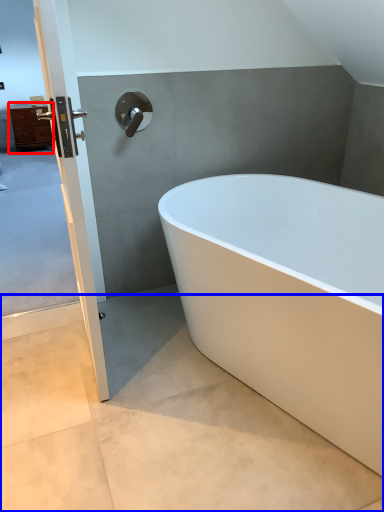
Question: Which point is further to the camera, chest of drawers (highlighted by a red box) or concrete (highlighted by a blue box)?

Choices:
 (A) chest of drawers
 (B) concrete

Answer: (A)